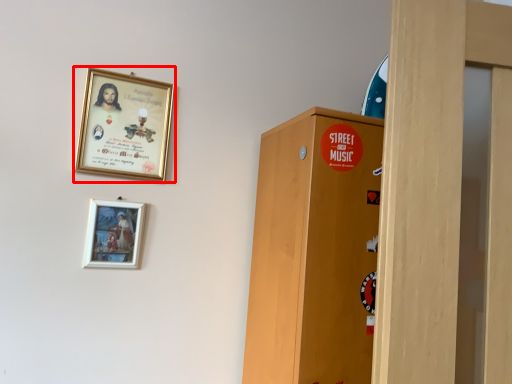
Question: From the image's perspective, what is the correct spatial positioning of picture frame (annotated by the red box) in reference to picture frame?

Choices:
 (A) below
 (B) above

Answer: (B)